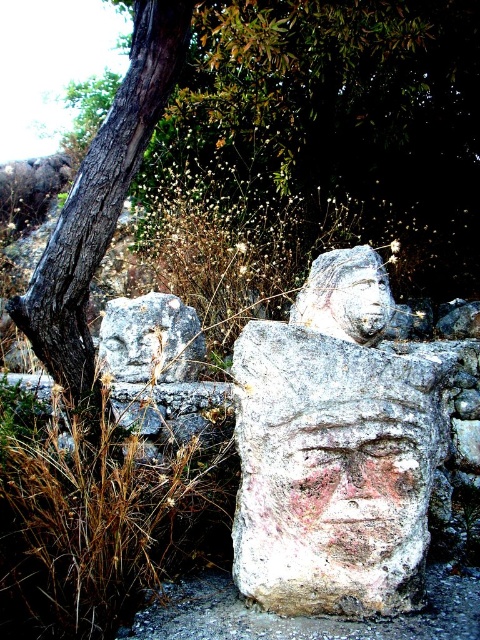
Question: Is brown grass at center below rough stone head at center?

Choices:
 (A) yes
 (B) no

Answer: (A)

Question: Which is nearer to the brown grass at center?

Choices:
 (A) white stone carving at center
 (B) smooth stone face at center
 (C) carved stone face at center
 (D) rough stone head at center

Answer: (A)

Question: Where is white stone carving at center located in relation to rough stone head at center in the image?

Choices:
 (A) right
 (B) left

Answer: (B)

Question: Considering the real-world distances, which object is closest to the carved stone face at center?

Choices:
 (A) smooth stone face at center
 (B) rough stone head at center
 (C) white stone carving at center

Answer: (C)

Question: Is brown grass at center below rough stone head at center?

Choices:
 (A) yes
 (B) no

Answer: (A)

Question: Estimate the real-world distances between objects in this image. Which object is farther from the carved stone face at center?

Choices:
 (A) brown grass at center
 (B) rough stone head at center
 (C) smooth stone face at center

Answer: (B)